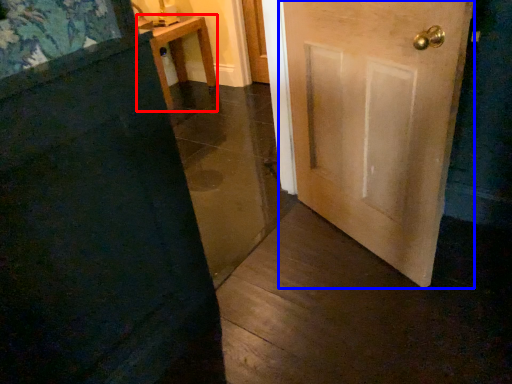
Question: Which object appears farthest to the camera in this image, furniture (highlighted by a red box) or door (highlighted by a blue box)?

Choices:
 (A) furniture
 (B) door

Answer: (A)